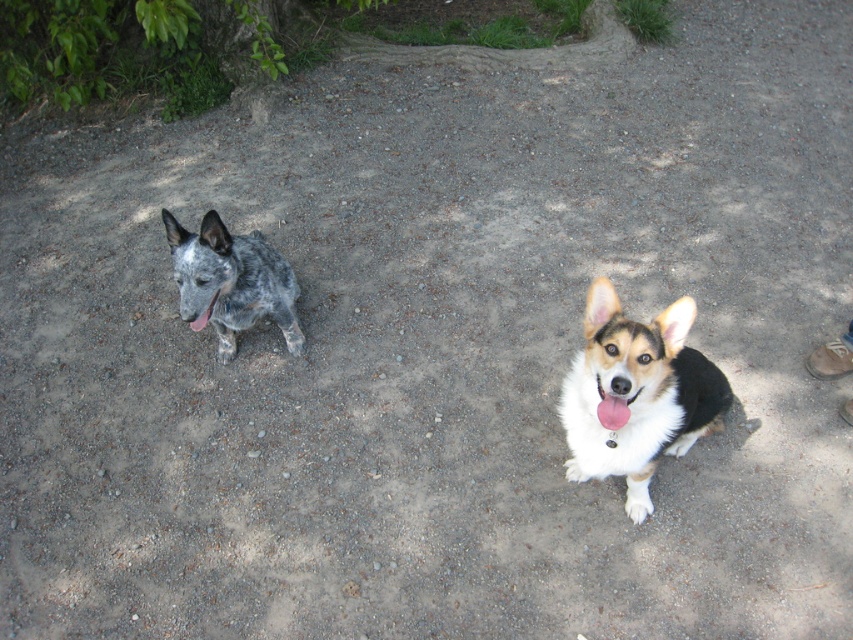
Question: Which point is farther to the camera?

Choices:
 (A) speckled fur dog at left
 (B) pink glossy tongue at left
 (C) tri-color fur dog at center

Answer: (B)

Question: Can you confirm if tri-color fur dog at center is positioned below pink glossy tongue at left?

Choices:
 (A) no
 (B) yes

Answer: (B)

Question: Is speckled fur dog at left bigger than pink glossy tongue at left?

Choices:
 (A) no
 (B) yes

Answer: (B)

Question: Which of these objects is positioned farthest from the speckled fur dog at left?

Choices:
 (A) tri-color fur dog at center
 (B) pink glossy tongue at left

Answer: (A)

Question: Does tri-color fur dog at center appear on the left side of speckled fur dog at left?

Choices:
 (A) yes
 (B) no

Answer: (B)

Question: Estimate the real-world distances between objects in this image. Which object is closer to the speckled fur dog at left?

Choices:
 (A) pink glossy tongue at left
 (B) tri-color fur dog at center

Answer: (A)